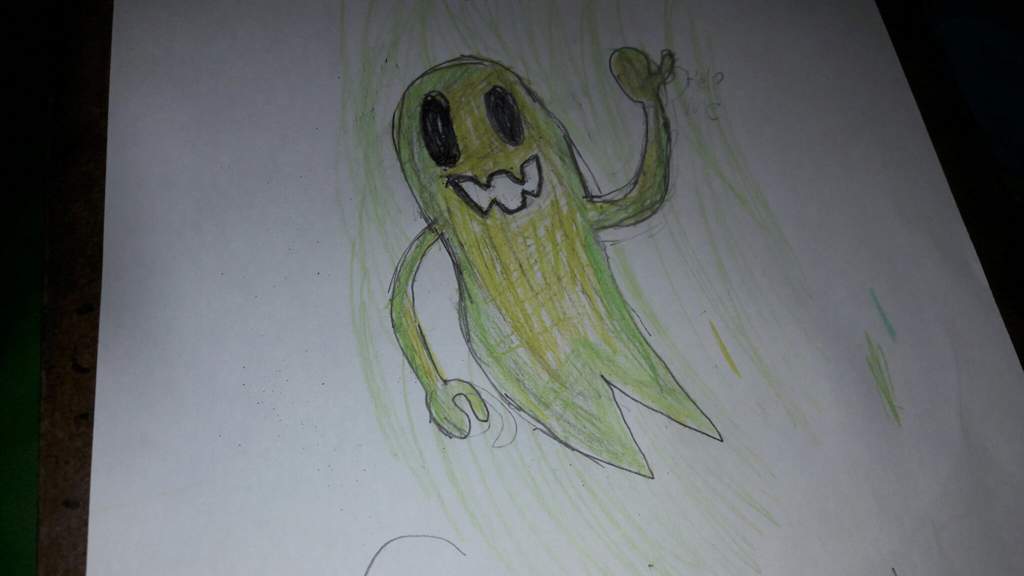
Find the location of `wooden clipboard`. wooden clipboard is located at coordinates (77, 329).